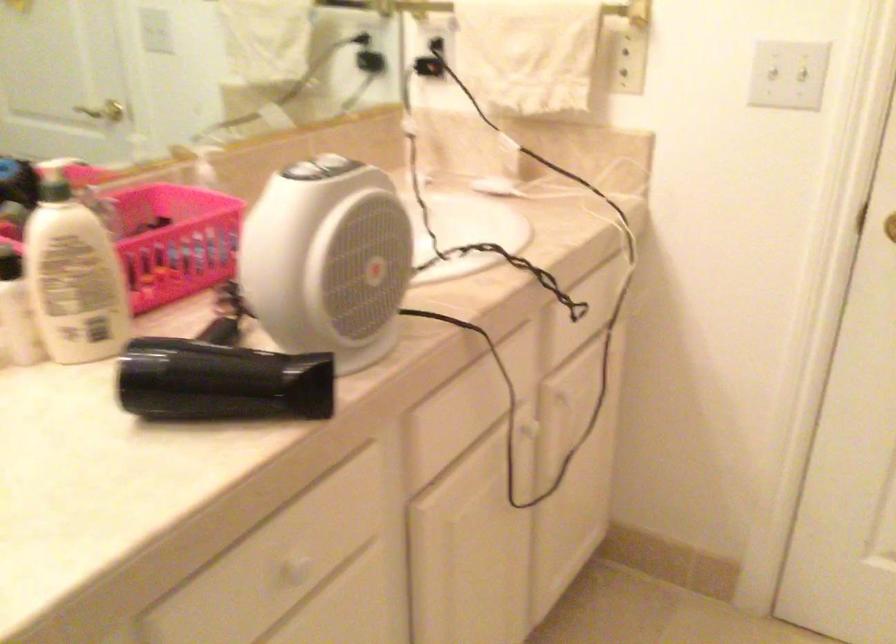
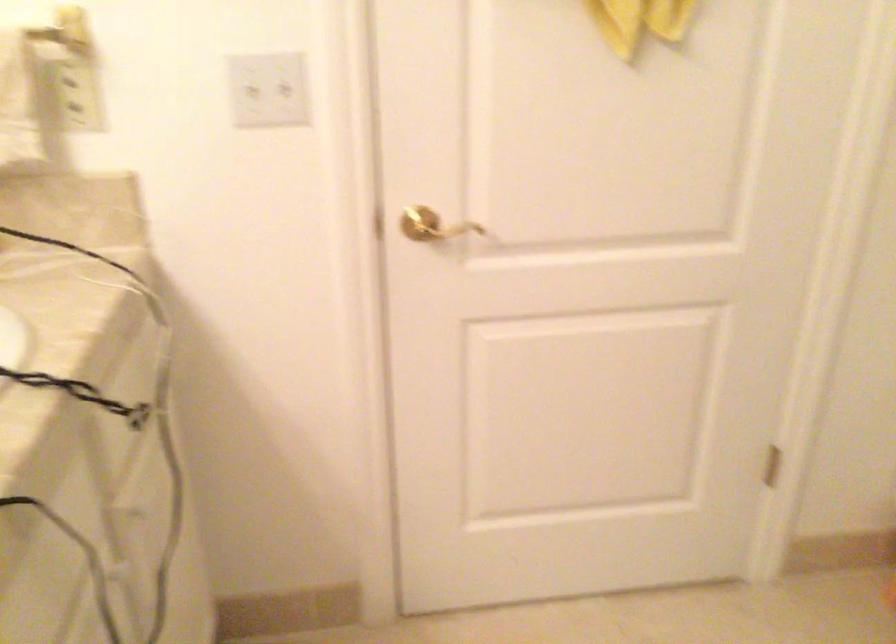
Question: The camera is either moving clockwise (left) or counter-clockwise (right) around the object. The first image is from the beginning of the video and the second image is from the end. Is the camera moving left or right when shooting the video?

Choices:
 (A) Left
 (B) Right

Answer: (A)